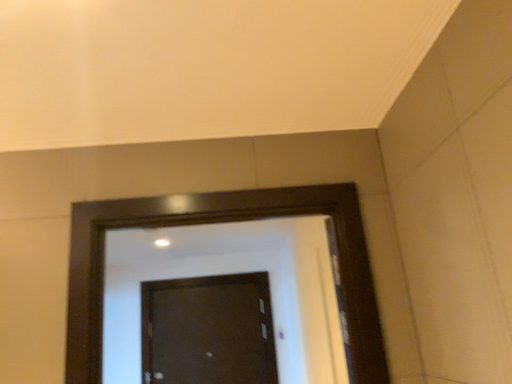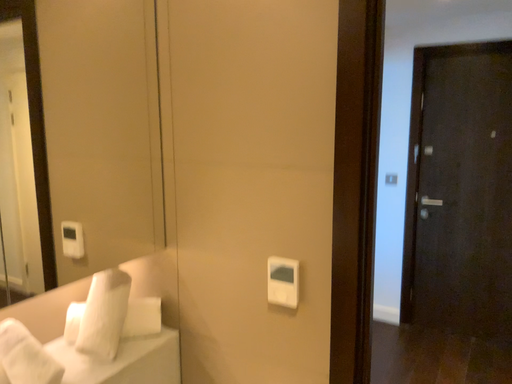
Question: Which way did the camera rotate in the video?

Choices:
 (A) rotated right
 (B) rotated left

Answer: (B)